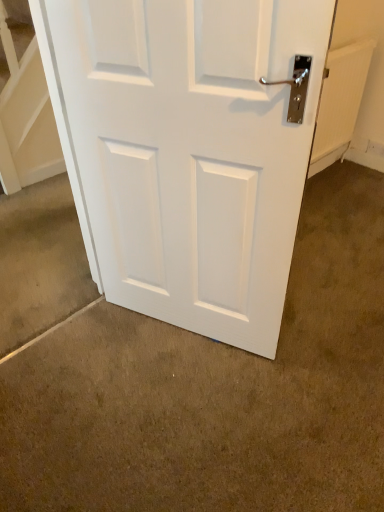
The image size is (384, 512). Identify the location of vacant space positioned to the left of white matte door at center. (93, 360).